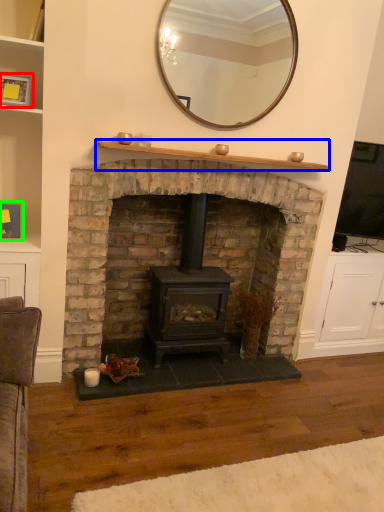
Question: Which object is the farthest from picture frame (highlighted by a red box)? Choose among these: mantle (highlighted by a blue box) or picture frame (highlighted by a green box).

Choices:
 (A) mantle
 (B) picture frame

Answer: (A)